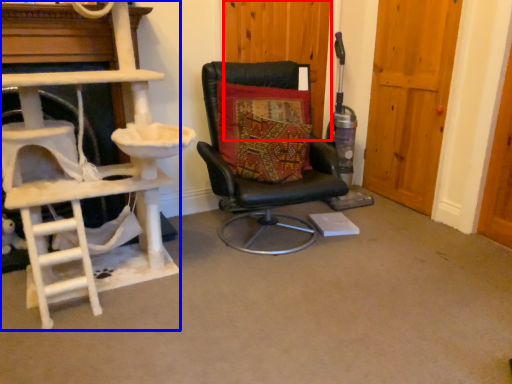
Question: Which object is further to the camera taking this photo, door (highlighted by a red box) or ladder (highlighted by a blue box)?

Choices:
 (A) door
 (B) ladder

Answer: (A)